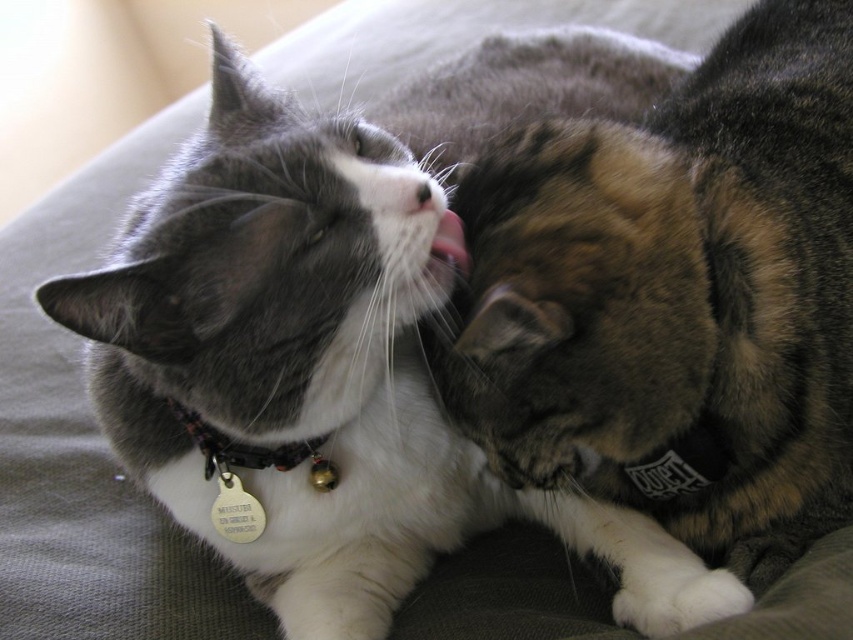
Question: Can you confirm if black fabric collar at left is positioned to the left of pink flesh at center?

Choices:
 (A) yes
 (B) no

Answer: (A)

Question: Which object is the farthest from the white fur at center?

Choices:
 (A) pink flesh at center
 (B) black fabric collar at left

Answer: (B)

Question: Is the position of tabby fur cat at center less distant than that of black fabric collar at left?

Choices:
 (A) yes
 (B) no

Answer: (A)

Question: Which point appears closest to the camera in this image?

Choices:
 (A) (408, 212)
 (B) (706, 444)
 (C) (242, 445)

Answer: (A)

Question: Is black fabric collar at left further to camera compared to white fur at center?

Choices:
 (A) no
 (B) yes

Answer: (B)

Question: Estimate the real-world distances between objects in this image. Which object is closer to the tabby fur cat at center?

Choices:
 (A) pink flesh at center
 (B) white fur at center
 (C) black fabric collar at left

Answer: (A)